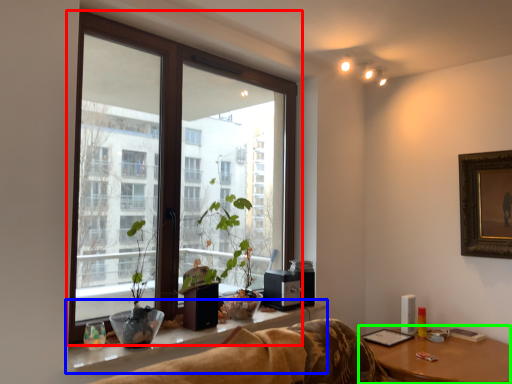
Question: Considering the real-world distances, which object is closest to window (highlighted by a red box)? window sill (highlighted by a blue box) or table (highlighted by a green box).

Choices:
 (A) window sill
 (B) table

Answer: (A)